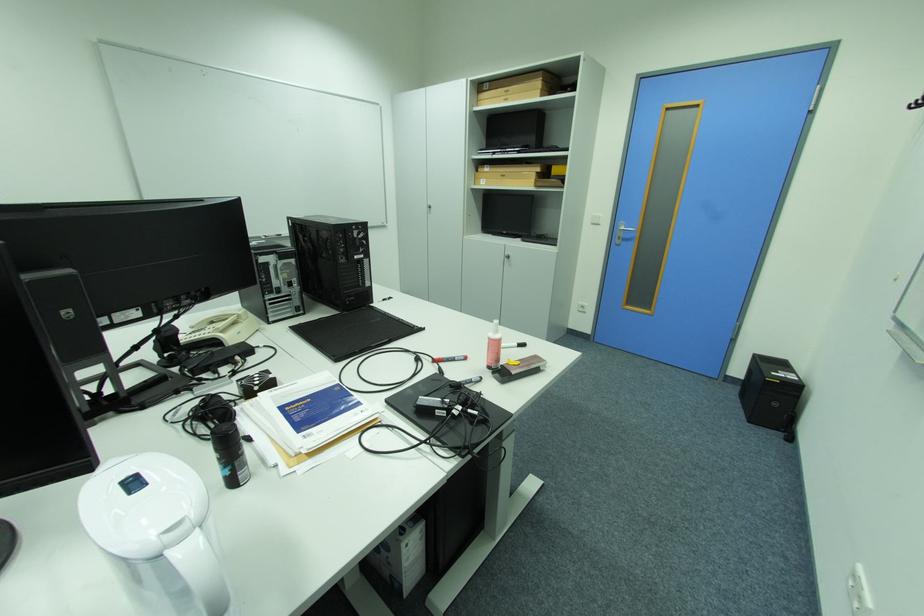
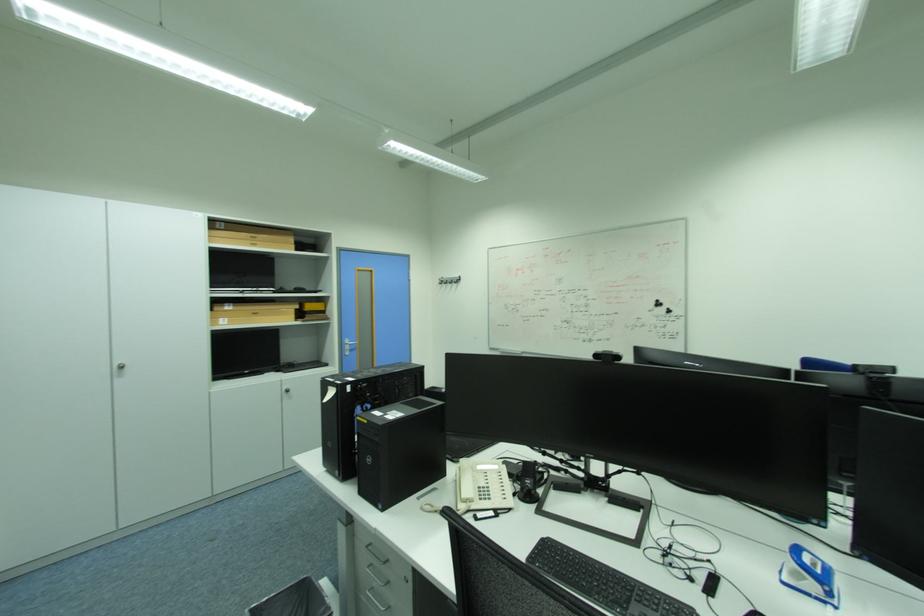
Question: I am providing you with two images of the same scene from different viewpoints. Please identify which objects are invisible in image2.

Choices:
 (A) silver wall hook
 (B) telephone handset
 (C) closed black laptop
 (D) none of these

Answer: (D)